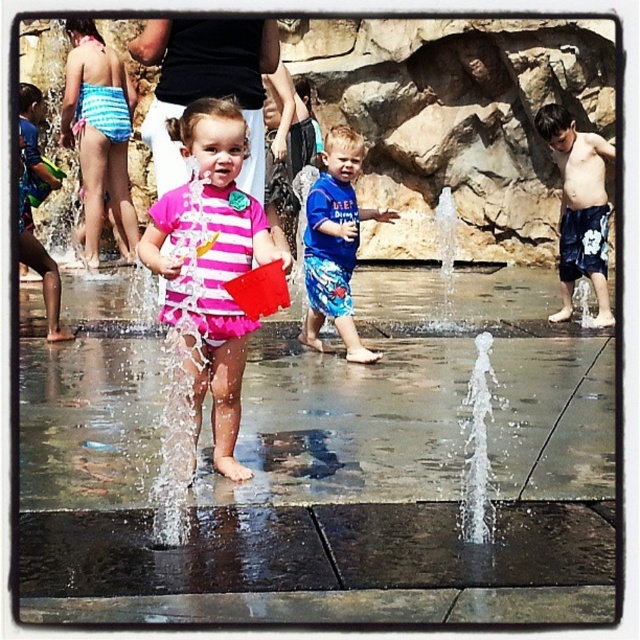
You are a photographer at the water park and want to capture a photo that includes both the blue striped swimsuit at upper left and the blue printed shorts at center. Based on their positions, which one should you focus on first to ensure both are in the frame?

The blue striped swimsuit at upper left is located above the blue printed shorts at center, so you should focus on the blue striped swimsuit at upper left first to ensure both are in the frame.

What is located at the coordinates point (99, 132)?

The blue striped swimsuit at upper left is located at point (99, 132).